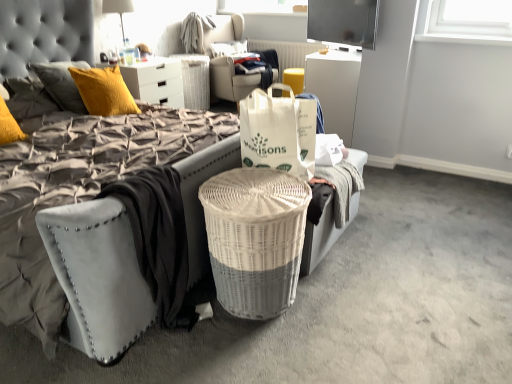
Locate an element on the screen. Image resolution: width=512 pixels, height=384 pixels. clear glass bottle at upper center is located at coordinates click(x=128, y=52).

Locate an element on the screen. matte white dresser at upper center is located at coordinates (156, 81).

What is the approximate height of suede-like gray mattress at lower left?

suede-like gray mattress at lower left is 25.10 inches in height.

At what (x,y) coordinates should I click in order to perform the action: click on clear glass bottle at upper center. Please return your answer as a coordinate pair (x, y). The height and width of the screenshot is (384, 512). Looking at the image, I should click on (128, 52).

Considering the sizes of white wicker picnic basket at center and matte white dresser at upper center in the image, is white wicker picnic basket at center bigger or smaller than matte white dresser at upper center?

Clearly, white wicker picnic basket at center is smaller in size than matte white dresser at upper center.

From a real-world perspective, does white wicker picnic basket at center sit lower than matte white dresser at upper center?

Indeed, from a real-world perspective, white wicker picnic basket at center is positioned beneath matte white dresser at upper center.

Is white wicker picnic basket at center further to the viewer compared to matte white dresser at upper center?

That is False.

In order to click on picnic basket below the matte white dresser at upper center (from the image's perspective) in this screenshot , I will do `click(255, 239)`.

Identify the location of lamp on the left of the velvet grey bed at center. This screenshot has width=512, height=384. (118, 9).

From a real-world perspective, is velvet grey bed at center located beneath matte white lamp at upper center?

Yes, from a real-world perspective, velvet grey bed at center is beneath matte white lamp at upper center.

Who is bigger, velvet grey bed at center or matte white lamp at upper center?

velvet grey bed at center.

Is velvet grey bed at center with matte white lamp at upper center?

velvet grey bed at center is not next to matte white lamp at upper center, and they're not touching.

The height and width of the screenshot is (384, 512). I want to click on desk in front of the white wicker trash bin/can at center, so click(335, 88).

From a real-world perspective, is white glossy desk at upper center positioned under white wicker trash bin/can at center based on gravity?

Actually, white glossy desk at upper center is physically above white wicker trash bin/can at center in the real world.

Is white glossy desk at upper center positioned with its back to white wicker trash bin/can at center?

No, white wicker trash bin/can at center is not at the back of white glossy desk at upper center.

Can you tell me how much white glossy desk at upper center and white wicker trash bin/can at center differ in facing direction?

The angle between the facing direction of white glossy desk at upper center and the facing direction of white wicker trash bin/can at center is 179 degrees.

How far apart are flat screen tv at upper center and white wicker picnic basket at center?

flat screen tv at upper center is 1.96 meters away from white wicker picnic basket at center.

From the image's perspective, which one is positioned lower, flat screen tv at upper center or white wicker picnic basket at center?

white wicker picnic basket at center is shown below in the image.

Is flat screen tv at upper center facing towards white wicker picnic basket at center?

No, flat screen tv at upper center is not turned towards white wicker picnic basket at center.

Choose the correct answer: Is flat screen tv at upper center inside white wicker picnic basket at center or outside it?

flat screen tv at upper center is spatially situated outside white wicker picnic basket at center.

Which object is positioned more to the left, white wicker picnic basket at center or suede-like gray mattress at lower left?

suede-like gray mattress at lower left is more to the left.

Is white wicker picnic basket at center wider or thinner than suede-like gray mattress at lower left?

In the image, white wicker picnic basket at center appears to be more narrow than suede-like gray mattress at lower left.

From a real-world perspective, which object stands above the other?

suede-like gray mattress at lower left.

Is white wicker picnic basket at center completely or partially outside of suede-like gray mattress at lower left?

Yes, white wicker picnic basket at center is outside of suede-like gray mattress at lower left.

Is matte white lamp at upper center completely or partially outside of matte white dresser at upper center?

matte white lamp at upper center is positioned outside matte white dresser at upper center.

From the picture: Between matte white lamp at upper center and matte white dresser at upper center, which one has larger size?

matte white dresser at upper center.

Find the location of a particular element. This screenshot has width=512, height=384. dresser below the matte white lamp at upper center (from a real-world perspective) is located at coordinates (156, 81).

Could you tell me if matte white lamp at upper center is facing matte white dresser at upper center?

No.

Consider the image. Measure the distance between matte white lamp at upper center and velvet grey bed at center.

matte white lamp at upper center and velvet grey bed at center are 2.26 meters apart.

Considering the sizes of objects matte white lamp at upper center and velvet grey bed at center in the image provided, who is smaller, matte white lamp at upper center or velvet grey bed at center?

With smaller size is matte white lamp at upper center.

How many degrees apart are the facing directions of matte white lamp at upper center and velvet grey bed at center?

The angle between the facing direction of matte white lamp at upper center and the facing direction of velvet grey bed at center is 0.5 degrees.

Which of these two, matte white lamp at upper center or velvet grey bed at center, is thinner?

matte white lamp at upper center is thinner.

Find the location of a particular element. The height and width of the screenshot is (384, 512). picnic basket below the matte white dresser at upper center (from the image's perspective) is located at coordinates (255, 239).

Identify the location of lamp above the velvet grey bed at center (from the image's perspective). (118, 9).

In the scene shown: Which object lies further to the anchor point white woven bag at center, white wicker picnic basket at center or white wicker trash bin/can at center?

white wicker trash bin/can at center.

Based on their spatial positions, is white wicker picnic basket at center or white textured bean bag chair at center closer to white wicker trash bin/can at center?

white textured bean bag chair at center is closer to white wicker trash bin/can at center.

Considering their positions, is suede-like gray mattress at lower left positioned closer to velvet grey bed at center than white woven bag at center?

suede-like gray mattress at lower left.

In the scene shown: Based on their spatial positions, is matte white lamp at upper center or white wicker trash bin/can at center further from white wicker picnic basket at center?

white wicker trash bin/can at center is positioned further to the anchor white wicker picnic basket at center.

Based on their spatial positions, is matte white dresser at upper center or white glossy desk at upper center further from clear glass bottle at upper center?

white glossy desk at upper center is further to clear glass bottle at upper center.

Considering their positions, is velvet grey bed at center positioned closer to white wicker picnic basket at center than matte white lamp at upper center?

velvet grey bed at center.

Which object lies further to the anchor point suede-like gray mattress at lower left, flat screen tv at upper center or white glossy desk at upper center?

Based on the image, flat screen tv at upper center appears to be further to suede-like gray mattress at lower left.

From the image, which object appears to be farther from matte white dresser at upper center, white glossy desk at upper center or velvet grey bed at center?

white glossy desk at upper center is positioned further to the anchor matte white dresser at upper center.

This screenshot has height=384, width=512. Identify the location of desk between suede-like gray mattress at lower left and white wicker trash bin/can at center along the z-axis. (335, 88).

Find the location of a particular element. desk positioned between white woven bag at center and white textured bean bag chair at center from near to far is located at coordinates (335, 88).

Where is `bottle between matte white dresser at upper center and white glossy desk at upper center in the horizontal direction`? bottle between matte white dresser at upper center and white glossy desk at upper center in the horizontal direction is located at coordinates (128, 52).

Where is `bean bag chair situated between matte white dresser at upper center and flat screen tv at upper center from left to right`? This screenshot has width=512, height=384. bean bag chair situated between matte white dresser at upper center and flat screen tv at upper center from left to right is located at coordinates (229, 60).